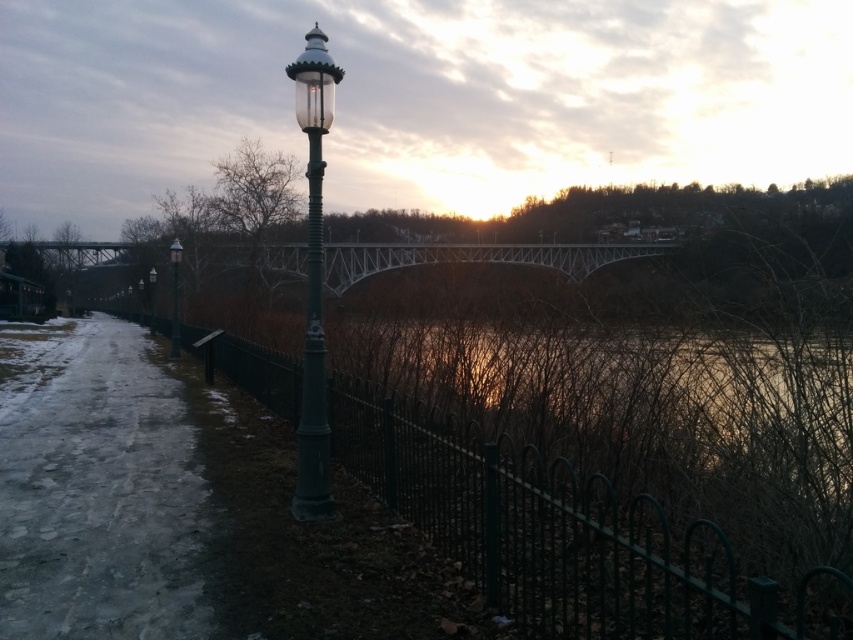
You are a painter standing at the end of the pathway and want to sketch the scene. You notice the green wrought iron fence at center and the green glass street light at left. Which object appears narrower in your painting?

The green wrought iron fence at center appears narrower because it has a lesser width compared to the green glass street light at left.

You are a city planner assessing the lighting in this winter scene. The green matte lamp post at center and the green glass street light at left are both present. Which one is taller?

The green glass street light at left is taller than the green matte lamp post at center.

You are standing at the center of the image and want to walk to the icy concrete path at lower left. Which direction should you move to reach it?

You should move to the lower left direction to reach the icy concrete path at lower left.